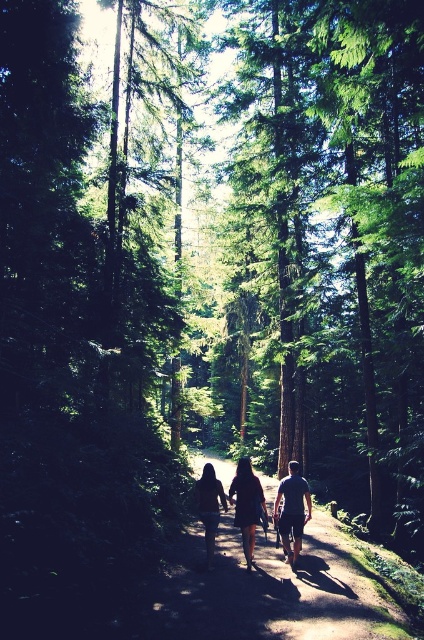
Can you confirm if dark blue t-shirt at center is taller than dark brown leather jacket at center?

Indeed, dark blue t-shirt at center has a greater height compared to dark brown leather jacket at center.

The width and height of the screenshot is (424, 640). Identify the location of dark blue t-shirt at center. point(292,512).

At what (x,y) coordinates should I click in order to perform the action: click on dark blue t-shirt at center. Please return your answer as a coordinate pair (x, y). The image size is (424, 640). Looking at the image, I should click on click(292, 512).

Is dark brown leather backpack at center positioned in front of dark blue t-shirt at center?

No, dark brown leather backpack at center is further to the viewer.

Identify the location of dark brown leather backpack at center. (247, 506).

Where is `dark brown leather backpack at center`? This screenshot has height=640, width=424. dark brown leather backpack at center is located at coordinates click(x=247, y=506).

Is point (248, 476) more distant than point (223, 509)?

No, (248, 476) is closer to viewer.

Who is shorter, black matte dress at center or dark brown leather jacket at center?

black matte dress at center is shorter.

Where is `black matte dress at center`? black matte dress at center is located at coordinates (247, 506).